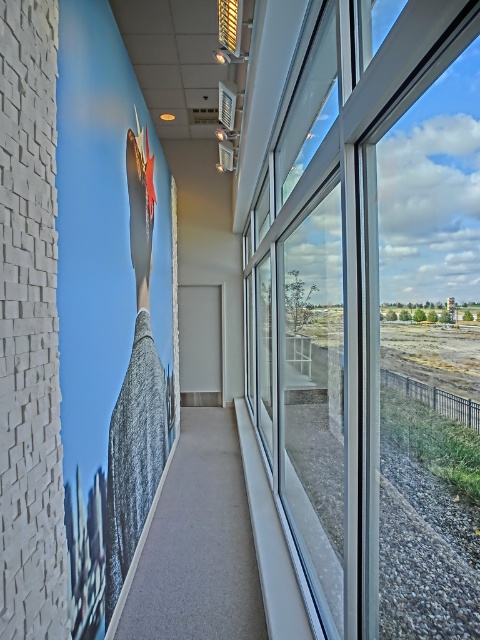
Does transparent glass window at right have a larger size compared to gray fabric at left?

Correct, transparent glass window at right is larger in size than gray fabric at left.

Between point (463, 93) and point (121, 556), which one is positioned behind?

Point (121, 556)

Where is `transparent glass window at right`? transparent glass window at right is located at coordinates (372, 314).